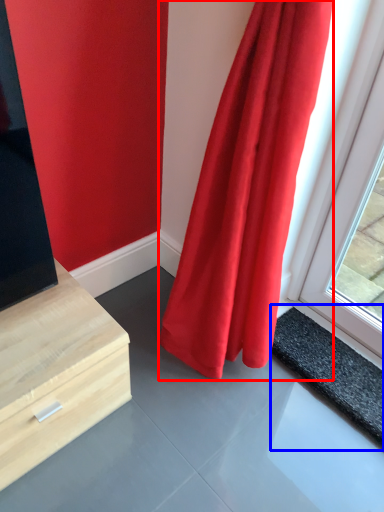
Question: Which of the following is the closest to the observer, curtain (highlighted by a red box) or slate (highlighted by a blue box)?

Choices:
 (A) curtain
 (B) slate

Answer: (A)